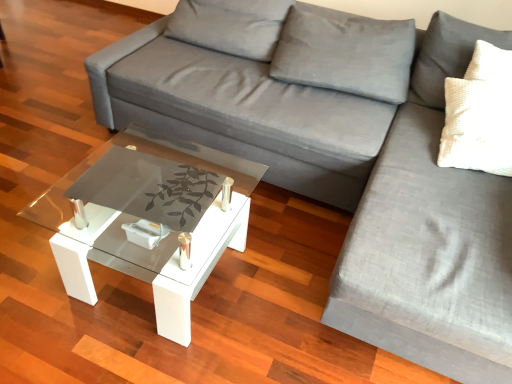
Question: Would you consider gray fabric couch at right, arranged as the 2th couch when viewed from the left, to be distant from gray fabric couch at center, the first couch when ordered from left to right?

Choices:
 (A) no
 (B) yes

Answer: (A)

Question: Is gray fabric couch at center, the first couch when ordered from left to right, at the back of gray fabric couch at right, arranged as the 2th couch when viewed from the left?

Choices:
 (A) yes
 (B) no

Answer: (B)

Question: Is gray fabric couch at right, which is the 1th couch from right to left, shorter than gray fabric couch at center, the first couch when ordered from left to right?

Choices:
 (A) yes
 (B) no

Answer: (A)

Question: From the image's perspective, is gray fabric couch at right, which is the 1th couch from right to left, beneath gray fabric couch at center, the first couch when ordered from left to right?

Choices:
 (A) yes
 (B) no

Answer: (A)

Question: From a real-world perspective, is gray fabric couch at right, which is the 1th couch from right to left, physically above gray fabric couch at center, which is the second couch in right-to-left order?

Choices:
 (A) no
 (B) yes

Answer: (A)

Question: Is gray fabric couch at right, arranged as the 2th couch when viewed from the left, oriented towards gray fabric couch at center, which is the second couch in right-to-left order?

Choices:
 (A) yes
 (B) no

Answer: (B)

Question: Is gray fabric couch at center, the first couch when ordered from left to right, thinner than gray fabric couch at right, which is the 1th couch from right to left?

Choices:
 (A) yes
 (B) no

Answer: (A)

Question: From the image's perspective, is gray fabric couch at center, the first couch when ordered from left to right, located beneath gray fabric couch at right, arranged as the 2th couch when viewed from the left?

Choices:
 (A) no
 (B) yes

Answer: (A)

Question: Can we say gray fabric couch at center, the first couch when ordered from left to right, lies outside gray fabric couch at right, which is the 1th couch from right to left?

Choices:
 (A) yes
 (B) no

Answer: (A)

Question: From a real-world perspective, is gray fabric couch at center, the first couch when ordered from left to right, under gray fabric couch at right, which is the 1th couch from right to left?

Choices:
 (A) no
 (B) yes

Answer: (A)

Question: Does gray fabric couch at center, the first couch when ordered from left to right, lie behind gray fabric couch at right, which is the 1th couch from right to left?

Choices:
 (A) yes
 (B) no

Answer: (A)

Question: Does gray fabric couch at center, the first couch when ordered from left to right, appear on the right side of gray fabric couch at right, arranged as the 2th couch when viewed from the left?

Choices:
 (A) no
 (B) yes

Answer: (A)

Question: Is transparent glass coffee table at center at the back of gray fabric couch at right, which is the 1th couch from right to left?

Choices:
 (A) no
 (B) yes

Answer: (A)